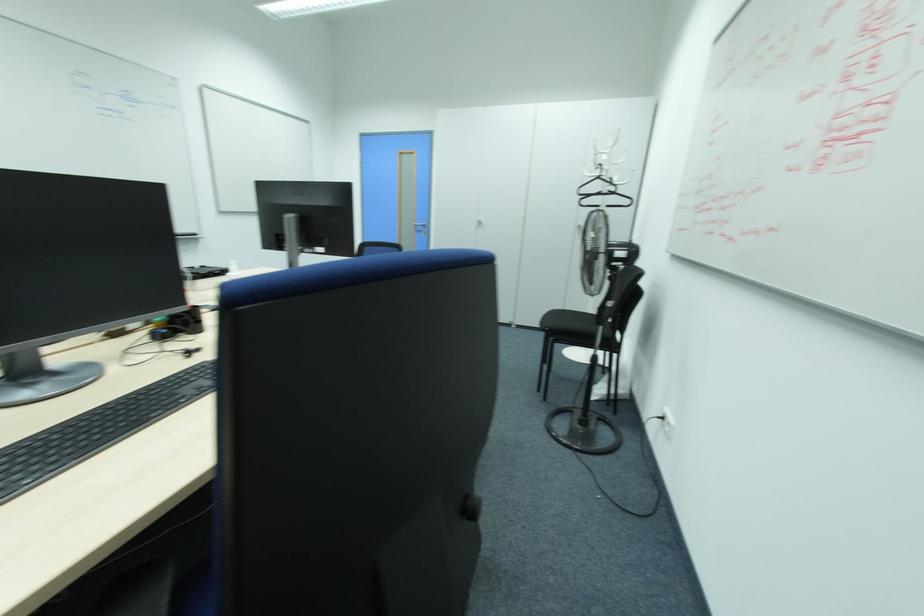
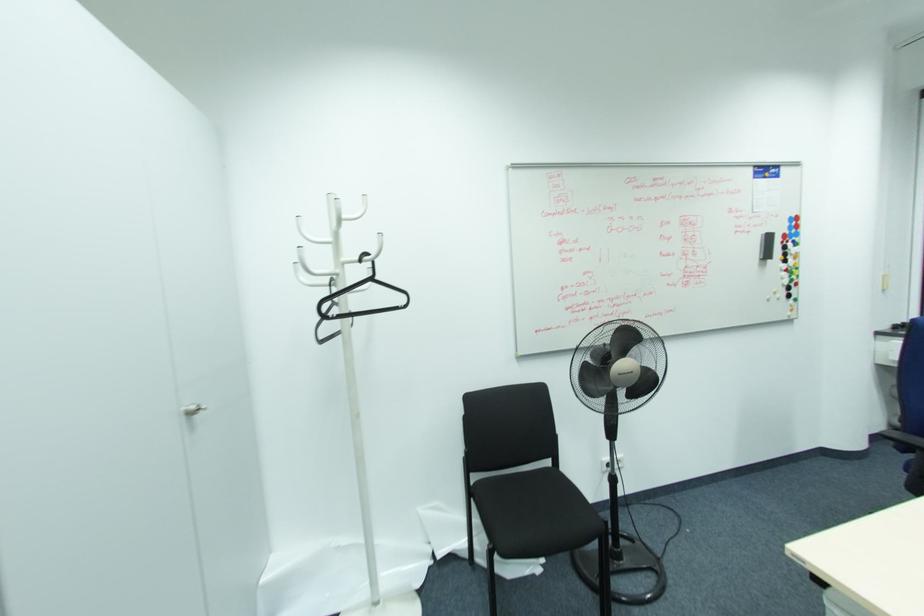
In the second image, find the point that corresponds to (599,177) in the first image.

(371, 280)